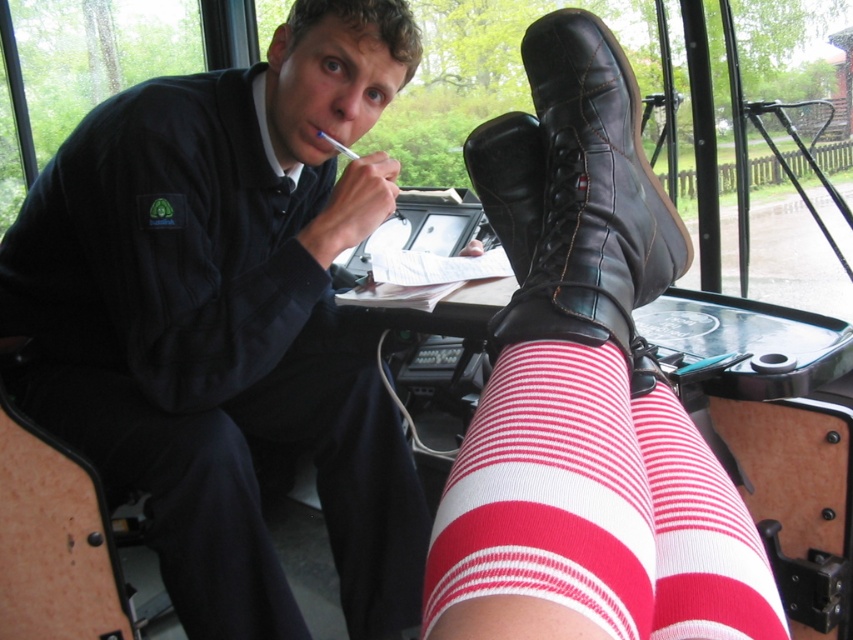
You are a passenger on a bus and need to determine if the matte black shirt at center can fully cover the white striped sock at lower center based on their sizes. Can it?

The matte black shirt at center is wider than the white striped sock at lower center, so it can fully cover the white striped sock at lower center.

You are a passenger on a bus and need to locate the matte black shirt at center. Based on the coordinates provided, where would you look to find it?

The matte black shirt at center is located at coordinates point (228, 317), which is near the center of the image.

You are a passenger on a bus and notice two items near your seat. The red striped tights at lower right and the leather boots at center. Which item is positioned lower in the image?

The red striped tights at lower right is positioned below the leather boots at center, so it is lower in the image.